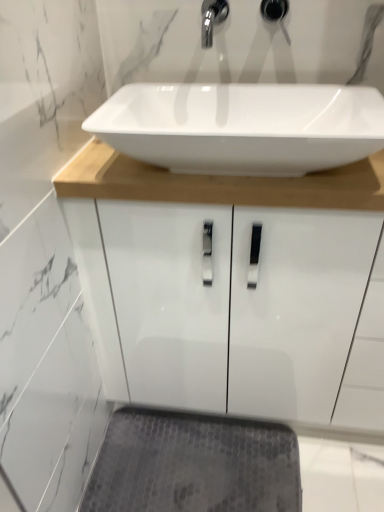
Locate an element on the screen. The height and width of the screenshot is (512, 384). free location above gray textured bath mat at lower center (from a real-world perspective) is located at coordinates (198, 460).